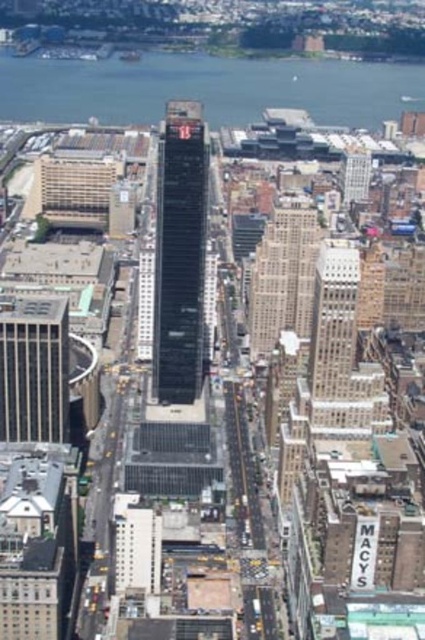
Looking at this image, is black glass building at center positioned at the back of beige stone building at center?

Yes, black glass building at center is further from the viewer.

Does black glass building at center appear over beige stone building at center?

Indeed, black glass building at center is positioned over beige stone building at center.

The width and height of the screenshot is (425, 640). I want to click on black glass building at center, so click(x=180, y=253).

At what (x,y) coordinates should I click in order to perform the action: click on black glass building at center. Please return your answer as a coordinate pair (x, y). The height and width of the screenshot is (640, 425). Looking at the image, I should click on (180, 253).

Does point (181, 154) come closer to viewer compared to point (61, 355)?

Yes, it is.

Can you confirm if black glass building at center is positioned below gray concrete skyscraper at left?

No, black glass building at center is not below gray concrete skyscraper at left.

Who is more forward, (203, 152) or (36, 324)?

Positioned in front is point (203, 152).

Identify the location of black glass building at center. Image resolution: width=425 pixels, height=640 pixels. (180, 253).

Can you confirm if gray concrete skyscraper at left is wider than beige stone building at center?

Correct, the width of gray concrete skyscraper at left exceeds that of beige stone building at center.

Identify the location of gray concrete skyscraper at left. This screenshot has height=640, width=425. (34, 369).

Find the location of `gray concrete skyscraper at left`. gray concrete skyscraper at left is located at coordinates coord(34,369).

Locate an element on the screen. This screenshot has width=425, height=640. gray concrete skyscraper at left is located at coordinates (34, 369).